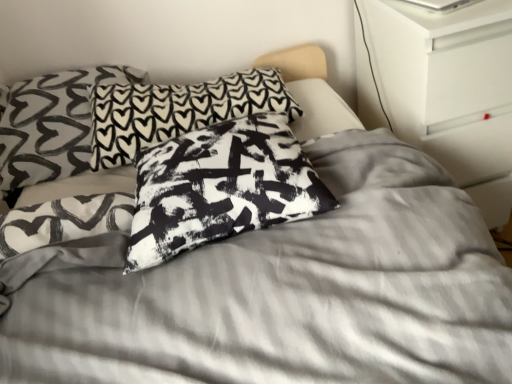
Measure the distance between point [416,99] and camera.

1.04 meters.

You are a GUI agent. You are given a task and a screenshot of the screen. Output one action in this format:
    pyautogui.click(x=<x>, y=<y>)
    Task: Click on the black and white printed pillow at center, positioned as the 2th pillow in back-to-front order
    
    Given the screenshot: What is the action you would take?
    pyautogui.click(x=52, y=124)

Is black printed pillow at center, placed as the 3th pillow when sorted from front to back, positioned with its back to white glossy dresser at upper right?

No, black printed pillow at center, placed as the 3th pillow when sorted from front to back, is not facing away from white glossy dresser at upper right.

Which is more distant, (x=153, y=129) or (x=381, y=91)?

The point (x=381, y=91) is farther.

How far apart are black printed pillow at center, placed as the 3th pillow when sorted from front to back, and white glossy dresser at upper right?

black printed pillow at center, placed as the 3th pillow when sorted from front to back, and white glossy dresser at upper right are 47.10 centimeters apart from each other.

Looking at the image, does black printed pillow at center, placed as the 3th pillow when sorted from front to back, seem bigger or smaller compared to white glossy dresser at upper right?

black printed pillow at center, placed as the 3th pillow when sorted from front to back, is smaller than white glossy dresser at upper right.

Does white glossy dresser at upper right have a lesser height compared to black-and-white printed pillow at center, the 1th pillow positioned from the front?

No, white glossy dresser at upper right is not shorter than black-and-white printed pillow at center, the 1th pillow positioned from the front.

The width and height of the screenshot is (512, 384). Find the location of `dresser above the black-and-white printed pillow at center, the 1th pillow positioned from the front (from the image's perspective)`. dresser above the black-and-white printed pillow at center, the 1th pillow positioned from the front (from the image's perspective) is located at coordinates (444, 89).

Does white glossy dresser at upper right appear on the right side of black-and-white printed pillow at center, the 1th pillow positioned from the front?

Yes.

Does white glossy dresser at upper right turn towards black-and-white printed pillow at center, the third pillow in the back-to-front sequence?

No.

Is black printed pillow at center, placed as the 3th pillow when sorted from front to back, aimed at black-and-white printed pillow at center, the 1th pillow positioned from the front?

No, black printed pillow at center, placed as the 3th pillow when sorted from front to back, is not turned towards black-and-white printed pillow at center, the 1th pillow positioned from the front.

Is black printed pillow at center, which is counted as the 1th pillow, starting from the back, completely or partially outside of black-and-white printed pillow at center, the 1th pillow positioned from the front?

Indeed, black printed pillow at center, which is counted as the 1th pillow, starting from the back, is completely outside black-and-white printed pillow at center, the 1th pillow positioned from the front.

Can you confirm if black printed pillow at center, placed as the 3th pillow when sorted from front to back, is shorter than black-and-white printed pillow at center, the third pillow in the back-to-front sequence?

No, black printed pillow at center, placed as the 3th pillow when sorted from front to back, is not shorter than black-and-white printed pillow at center, the third pillow in the back-to-front sequence.

From the picture: From the image's perspective, is white glossy dresser at upper right above or below black printed pillow at center, placed as the 3th pillow when sorted from front to back?

white glossy dresser at upper right is situated higher than black printed pillow at center, placed as the 3th pillow when sorted from front to back, in the image.

Does white glossy dresser at upper right touch black printed pillow at center, placed as the 3th pillow when sorted from front to back?

They are not placed beside each other.

Which object is more forward, white glossy dresser at upper right or black printed pillow at center, placed as the 3th pillow when sorted from front to back?

white glossy dresser at upper right.

Between point (479, 99) and point (97, 142), which one is positioned in front?

The point (479, 99) is more forward.

Looking at this image, can you confirm if black-and-white printed pillow at center, the 1th pillow positioned from the front, is bigger than black and white printed pillow at center, acting as the second pillow starting from the front?

No, black-and-white printed pillow at center, the 1th pillow positioned from the front, is not bigger than black and white printed pillow at center, acting as the second pillow starting from the front.

At what (x,y) coordinates should I click in order to perform the action: click on the 2nd pillow counting from the left side of the black-and-white printed pillow at center, the third pillow in the back-to-front sequence. Please return your answer as a coordinate pair (x, y). Looking at the image, I should click on (52, 124).

Does point (312, 175) lie behind point (14, 84)?

No, it is in front of (14, 84).

Is black-and-white printed pillow at center, the third pillow in the back-to-front sequence, located outside black and white printed pillow at center, positioned as the 2th pillow in back-to-front order?

Yes, black-and-white printed pillow at center, the third pillow in the back-to-front sequence, is outside of black and white printed pillow at center, positioned as the 2th pillow in back-to-front order.

Does black-and-white printed pillow at center, the third pillow in the back-to-front sequence, have a lesser width compared to black printed pillow at center, which is counted as the 1th pillow, starting from the back?

Correct, the width of black-and-white printed pillow at center, the third pillow in the back-to-front sequence, is less than that of black printed pillow at center, which is counted as the 1th pillow, starting from the back.

Do you think black-and-white printed pillow at center, the 1th pillow positioned from the front, is within black printed pillow at center, which is counted as the 1th pillow, starting from the back, or outside of it?

black-and-white printed pillow at center, the 1th pillow positioned from the front, lies outside black printed pillow at center, which is counted as the 1th pillow, starting from the back.

You are a GUI agent. You are given a task and a screenshot of the screen. Output one action in this format:
    pyautogui.click(x=<x>, y=<y>)
    Task: Click on the pillow below the black-and-white printed pillow at center, the 1th pillow positioned from the front (from a real-world perspective)
    
    Given the screenshot: What is the action you would take?
    pyautogui.click(x=177, y=111)

Is the position of black and white printed pillow at center, positioned as the 2th pillow in back-to-front order, less distant than that of white glossy dresser at upper right?

That is False.

Between black and white printed pillow at center, positioned as the 2th pillow in back-to-front order, and white glossy dresser at upper right, which one has smaller width?

Thinner between the two is black and white printed pillow at center, positioned as the 2th pillow in back-to-front order.

Would you say black and white printed pillow at center, acting as the second pillow starting from the front, contains white glossy dresser at upper right?

No, white glossy dresser at upper right is not surrounded by black and white printed pillow at center, acting as the second pillow starting from the front.

From the white glossy dresser at upper right, count 2nd pillows backward and point to it. Please provide its 2D coordinates.

[(177, 111)]

This screenshot has height=384, width=512. In order to click on dresser above the black-and-white printed pillow at center, the 1th pillow positioned from the front (from the image's perspective) in this screenshot , I will do `click(444, 89)`.

Looking at the image, which one is located closer to black printed pillow at center, placed as the 3th pillow when sorted from front to back, white glossy dresser at upper right or black-and-white printed pillow at center, the third pillow in the back-to-front sequence?

black-and-white printed pillow at center, the third pillow in the back-to-front sequence, is closer to black printed pillow at center, placed as the 3th pillow when sorted from front to back.

From the image, which object appears to be farther from black and white printed pillow at center, positioned as the 2th pillow in back-to-front order, black-and-white printed pillow at center, the third pillow in the back-to-front sequence, or black printed pillow at center, which is counted as the 1th pillow, starting from the back?

black-and-white printed pillow at center, the third pillow in the back-to-front sequence, is positioned further to the anchor black and white printed pillow at center, positioned as the 2th pillow in back-to-front order.

Based on their spatial positions, is white glossy dresser at upper right or black printed pillow at center, placed as the 3th pillow when sorted from front to back, closer to black and white printed pillow at center, acting as the second pillow starting from the front?

The object closer to black and white printed pillow at center, acting as the second pillow starting from the front, is black printed pillow at center, placed as the 3th pillow when sorted from front to back.

Considering their positions, is black-and-white printed pillow at center, the third pillow in the back-to-front sequence, positioned further to black and white printed pillow at center, positioned as the 2th pillow in back-to-front order, than white glossy dresser at upper right?

white glossy dresser at upper right is further to black and white printed pillow at center, positioned as the 2th pillow in back-to-front order.

Based on the photo, based on their spatial positions, is black and white printed pillow at center, positioned as the 2th pillow in back-to-front order, or white glossy dresser at upper right closer to black printed pillow at center, placed as the 3th pillow when sorted from front to back?

The object closer to black printed pillow at center, placed as the 3th pillow when sorted from front to back, is black and white printed pillow at center, positioned as the 2th pillow in back-to-front order.

Estimate the real-world distances between objects in this image. Which object is further from black-and-white printed pillow at center, the third pillow in the back-to-front sequence, black and white printed pillow at center, positioned as the 2th pillow in back-to-front order, or white glossy dresser at upper right?

white glossy dresser at upper right is further to black-and-white printed pillow at center, the third pillow in the back-to-front sequence.

When comparing their distances from white glossy dresser at upper right, does black and white printed pillow at center, positioned as the 2th pillow in back-to-front order, or black-and-white printed pillow at center, the 1th pillow positioned from the front, seem closer?

Among the two, black-and-white printed pillow at center, the 1th pillow positioned from the front, is located nearer to white glossy dresser at upper right.

From the image, which object appears to be nearer to black-and-white printed pillow at center, the 1th pillow positioned from the front, white glossy dresser at upper right or black printed pillow at center, which is counted as the 1th pillow, starting from the back?

black printed pillow at center, which is counted as the 1th pillow, starting from the back, is positioned closer to the anchor black-and-white printed pillow at center, the 1th pillow positioned from the front.

You are a GUI agent. You are given a task and a screenshot of the screen. Output one action in this format:
    pyautogui.click(x=<x>, y=<y>)
    Task: Click on the pillow located between black and white printed pillow at center, acting as the second pillow starting from the front, and black-and-white printed pillow at center, the 1th pillow positioned from the front, in the left-right direction
    The height and width of the screenshot is (384, 512).
    Given the screenshot: What is the action you would take?
    pyautogui.click(x=177, y=111)

At what (x,y) coordinates should I click in order to perform the action: click on pillow between black printed pillow at center, which is counted as the 1th pillow, starting from the back, and white glossy dresser at upper right. Please return your answer as a coordinate pair (x, y). Image resolution: width=512 pixels, height=384 pixels. Looking at the image, I should click on (220, 187).